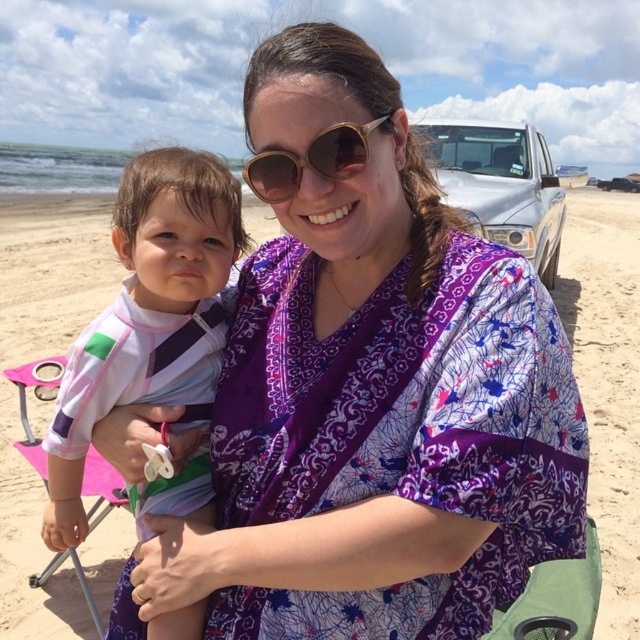
You are a photographer at the beach scene described. You notice the beige sand at center and the gold metallic sunglasses at center. Which object is positioned higher in the image?

The beige sand at center is positioned higher than the gold metallic sunglasses at center in the image.

You are a photographer at the beach scene. You need to take a photo of the gold metallic sunglasses at center and the white striped rash guard at center. Which object should be placed to the right side in the photo?

The gold metallic sunglasses at center should be placed to the right side in the photo because the white striped rash guard at center is positioned on the left side of it.